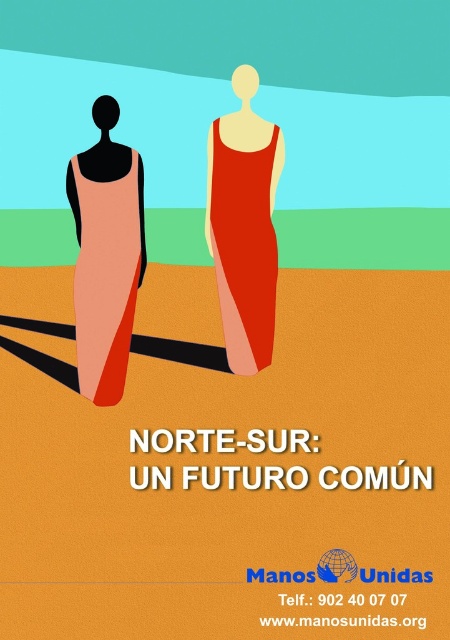
Question: Which point is farther from the camera taking this photo?

Choices:
 (A) (115, 195)
 (B) (234, 300)

Answer: (B)

Question: From the image, what is the correct spatial relationship of matte red dress at center in relation to matte peach dress at left?

Choices:
 (A) right
 (B) left

Answer: (A)

Question: Which point is farther to the camera?

Choices:
 (A) matte red dress at center
 (B) matte peach dress at left

Answer: (A)

Question: Is matte red dress at center closer to camera compared to matte peach dress at left?

Choices:
 (A) no
 (B) yes

Answer: (A)

Question: Which of the following is the closest to the observer?

Choices:
 (A) matte red dress at center
 (B) matte peach dress at left

Answer: (B)

Question: Does matte red dress at center come behind matte peach dress at left?

Choices:
 (A) no
 (B) yes

Answer: (B)